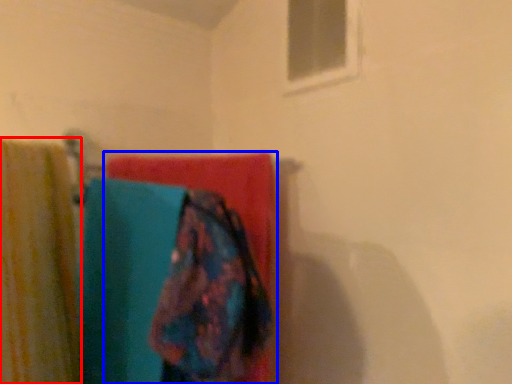
Question: Which point is closer to the camera, curtain (highlighted by a red box) or towel (highlighted by a blue box)?

Choices:
 (A) curtain
 (B) towel

Answer: (A)